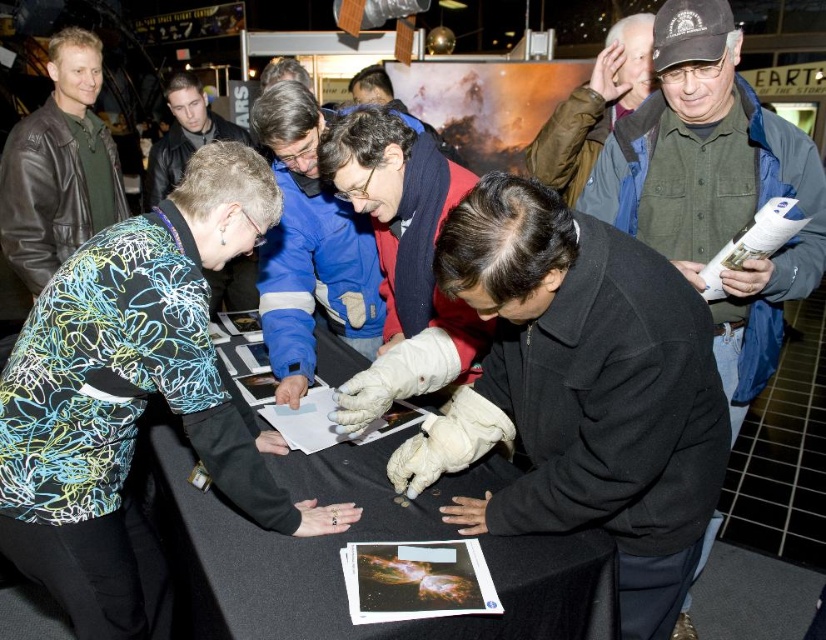
Which is behind, point (741, 314) or point (216, 132)?

Positioned behind is point (216, 132).

Is point (744, 189) farther from camera compared to point (210, 140)?

No, (744, 189) is in front of (210, 140).

Does point (768, 352) lie behind point (179, 140)?

No, (768, 352) is in front of (179, 140).

The height and width of the screenshot is (640, 826). What are the coordinates of `green button-down shirt at upper right` in the screenshot? It's located at (713, 186).

Does black fabric table at center have a greater width compared to green button-down shirt at upper right?

Indeed, black fabric table at center has a greater width compared to green button-down shirt at upper right.

Which is above, black fabric table at center or green button-down shirt at upper right?

Positioned higher is green button-down shirt at upper right.

Which is behind, point (245, 520) or point (738, 410)?

Point (738, 410)

At what (x,y) coordinates should I click in order to perform the action: click on black fabric table at center. Please return your answer as a coordinate pair (x, y). Looking at the image, I should click on pos(343,544).

Is point (97, 128) positioned after point (558, 115)?

Yes, it is.

Which is behind, point (81, 35) or point (542, 125)?

The point (81, 35) is behind.

What are the coordinates of `matte black jacket at left` in the screenshot? It's located at point(59,166).